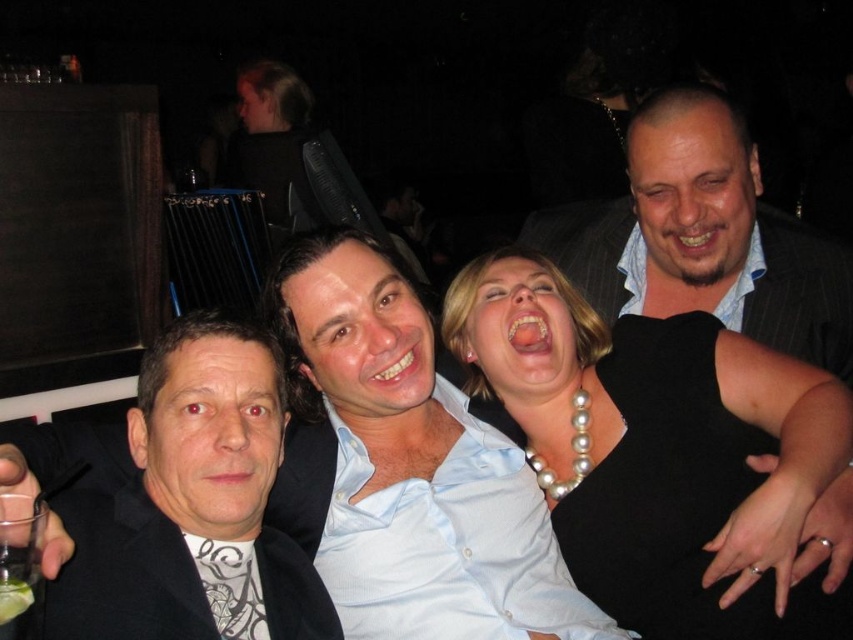
You are a photographer trying to adjust the lighting for a group photo. You notice the pearl necklace at center and the light blue shirt at center. Which object should you focus on first to ensure proper exposure, considering their positions?

The light blue shirt at center should be focused on first because the pearl necklace at center is to its right, making the shirt closer to the center of the group, thus requiring balanced exposure.

Consider the image. You are a photographer trying to adjust the lighting for a group photo. You notice the light blue shirt at center and the black matte jacket at left. Which one is more to the left in the image?

The black matte jacket at left is more to the left than the light blue shirt at center.

Looking at this image, you are a photographer standing at the camera position. You want to adjust the focus to ensure the black matte jacket at left is sharp. Given that the camera has a minimum focusing distance of 36 inches, will you need to move closer or farther away?

The distance between the black matte jacket at left and the camera is 37.19 inches, which is just beyond the camera minimum focusing distance of 36 inches. Therefore, you need to move closer to the black matte jacket at left to ensure it is in focus.